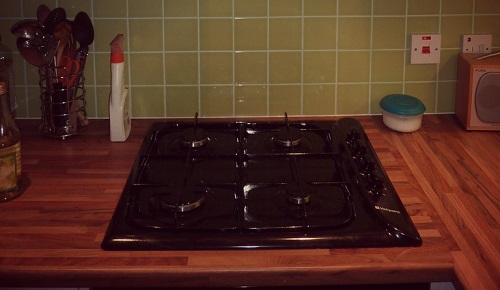
This screenshot has height=290, width=500. What are the coordinates of `radio` in the screenshot? It's located at (486, 86).